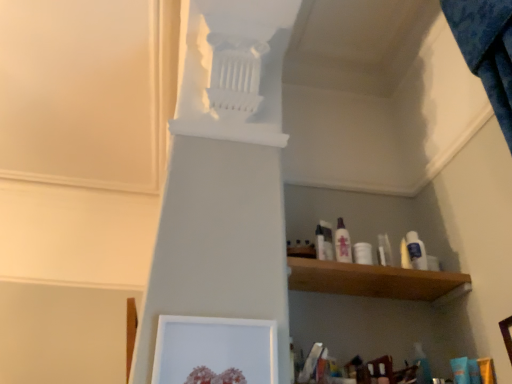
Question: Is white plastic bottle at upper right, which is the 1th toiletry from right to left, at the left side of white plastic bottle at center, which is the 3th toiletry from right to left?

Choices:
 (A) no
 (B) yes

Answer: (A)

Question: Is white plastic bottle at upper right, which is the 1th toiletry from right to left, located outside white plastic bottle at center, which is the 3th toiletry from right to left?

Choices:
 (A) no
 (B) yes

Answer: (B)

Question: Is white plastic bottle at upper right, which is the 3th toiletry in left-to-right order, facing towards white plastic bottle at center, which is the 3th toiletry from right to left?

Choices:
 (A) no
 (B) yes

Answer: (A)

Question: Does white plastic bottle at upper right, which is the 1th toiletry from right to left, have a greater width compared to white plastic bottle at center, placed as the first toiletry when sorted from left to right?

Choices:
 (A) yes
 (B) no

Answer: (B)

Question: Is white plastic bottle at upper right, which is the 1th toiletry from right to left, bigger than white plastic bottle at center, placed as the first toiletry when sorted from left to right?

Choices:
 (A) yes
 (B) no

Answer: (A)

Question: Does white plastic bottle at upper right, which is the 1th toiletry from right to left, have a greater height compared to white plastic bottle at center, placed as the first toiletry when sorted from left to right?

Choices:
 (A) yes
 (B) no

Answer: (A)

Question: From the image's perspective, does white matte picture frame at lower center appear higher than white plastic bottle at upper right, which is the 3th toiletry in left-to-right order?

Choices:
 (A) no
 (B) yes

Answer: (A)

Question: From a real-world perspective, is white matte picture frame at lower center physically below white plastic bottle at upper right, which is the 1th toiletry from right to left?

Choices:
 (A) yes
 (B) no

Answer: (A)

Question: Is white matte picture frame at lower center completely or partially outside of white plastic bottle at upper right, which is the 1th toiletry from right to left?

Choices:
 (A) no
 (B) yes

Answer: (B)

Question: Considering the relative sizes of white matte picture frame at lower center and white plastic bottle at upper right, which is the 1th toiletry from right to left, in the image provided, is white matte picture frame at lower center bigger than white plastic bottle at upper right, which is the 1th toiletry from right to left,?

Choices:
 (A) no
 (B) yes

Answer: (B)

Question: Does white matte picture frame at lower center contain white plastic bottle at upper right, which is the 3th toiletry in left-to-right order?

Choices:
 (A) no
 (B) yes

Answer: (A)

Question: Does white matte picture frame at lower center come in front of white plastic bottle at upper right, which is the 1th toiletry from right to left?

Choices:
 (A) yes
 (B) no

Answer: (A)

Question: Is white plastic bottle at upper right, which is the 1th toiletry from right to left, oriented away from white matte picture frame at lower center?

Choices:
 (A) yes
 (B) no

Answer: (B)